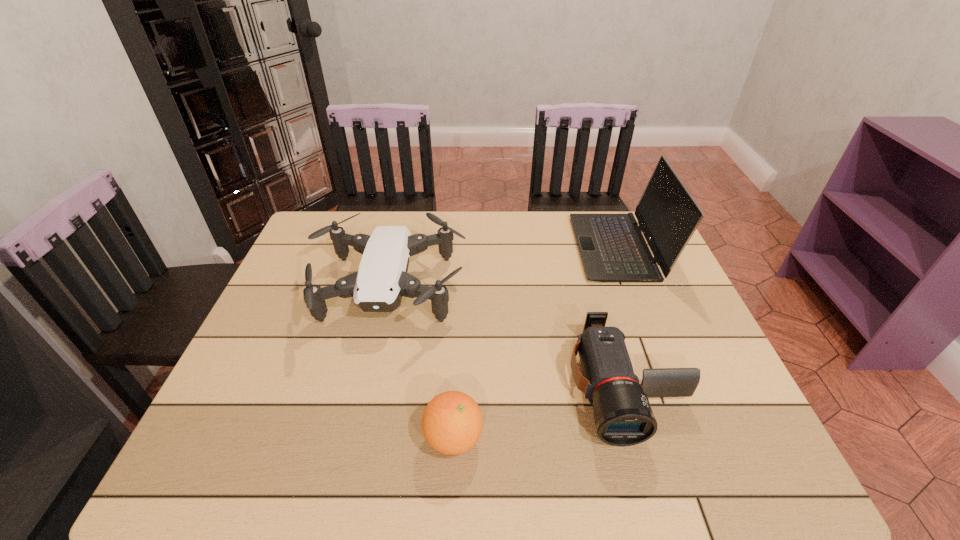
The height and width of the screenshot is (540, 960). What are the coordinates of `free space that satisfies the following two spatial constraints: 1. on the camera side of the orange; 2. on the left side of the drone` in the screenshot? It's located at (354, 437).

Find the location of a particular element. This screenshot has height=540, width=960. vacant space that satisfies the following two spatial constraints: 1. on the camera side of the second tallest object; 2. on the left side of the orange is located at coordinates (354, 437).

Locate an element on the screen. The image size is (960, 540). free space that satisfies the following two spatial constraints: 1. on the screen of the tallest object; 2. on the camera side of the drone is located at coordinates (636, 290).

Locate an element on the screen. free spot that satisfies the following two spatial constraints: 1. on the camera side of the second tallest object; 2. on the left side of the orange is located at coordinates (354, 437).